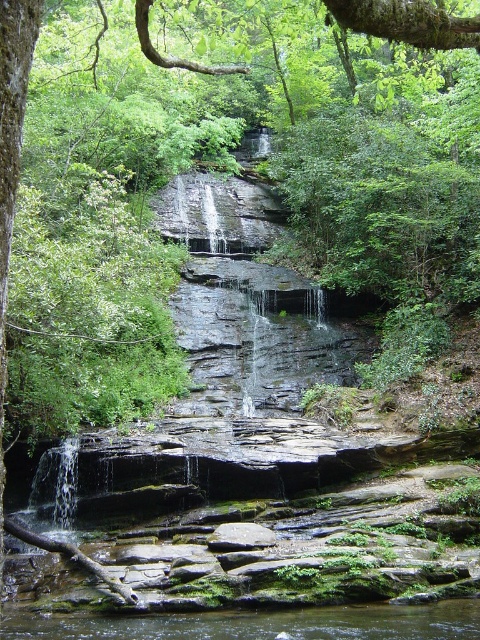
Who is positioned more to the right, clear water at center or gray smooth rock at center?

gray smooth rock at center

Consider the image. Can you confirm if clear water at center is smaller than gray smooth rock at center?

Incorrect, clear water at center is not smaller in size than gray smooth rock at center.

Describe the element at coordinates (257, 624) in the screenshot. I see `clear water at center` at that location.

I want to click on clear water at center, so click(x=257, y=624).